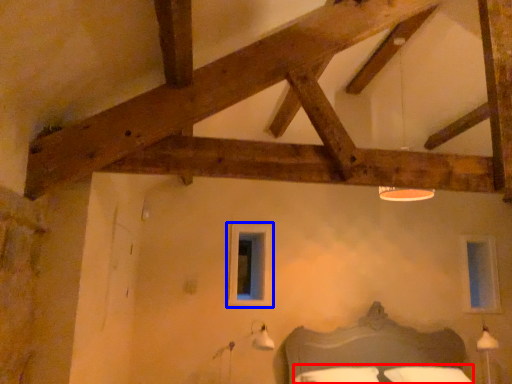
Question: Among these objects, which one is nearest to the camera, bedding (highlighted by a red box) or window (highlighted by a blue box)?

Choices:
 (A) bedding
 (B) window

Answer: (A)